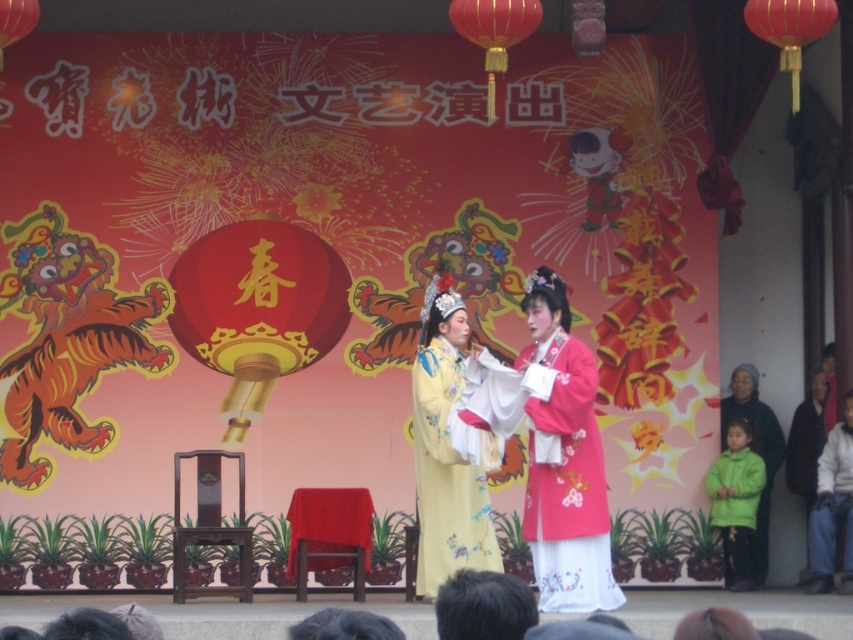
Question: Among these points, which one is farthest from the camera?

Choices:
 (A) (816, 432)
 (B) (447, 502)
 (C) (759, 564)

Answer: (A)

Question: Does green fuzzy coat at lower right appear under dark brown leather jacket at right?

Choices:
 (A) no
 (B) yes

Answer: (A)

Question: Is matte white coat at right closer to the viewer compared to green fuzzy coat at lower right?

Choices:
 (A) yes
 (B) no

Answer: (A)

Question: Which point appears farthest from the camera in this image?

Choices:
 (A) (728, 396)
 (B) (816, 372)
 (C) (492, 612)
 (D) (830, 532)

Answer: (B)

Question: Considering the real-world distances, which object is farthest from the green fuzzy coat at lower right?

Choices:
 (A) green fabric coat at lower right
 (B) dark brown leather jacket at right
 (C) yellow satin robe at center

Answer: (C)

Question: Can you confirm if green fabric coat at lower right is smaller than dark brown leather jacket at right?

Choices:
 (A) yes
 (B) no

Answer: (B)